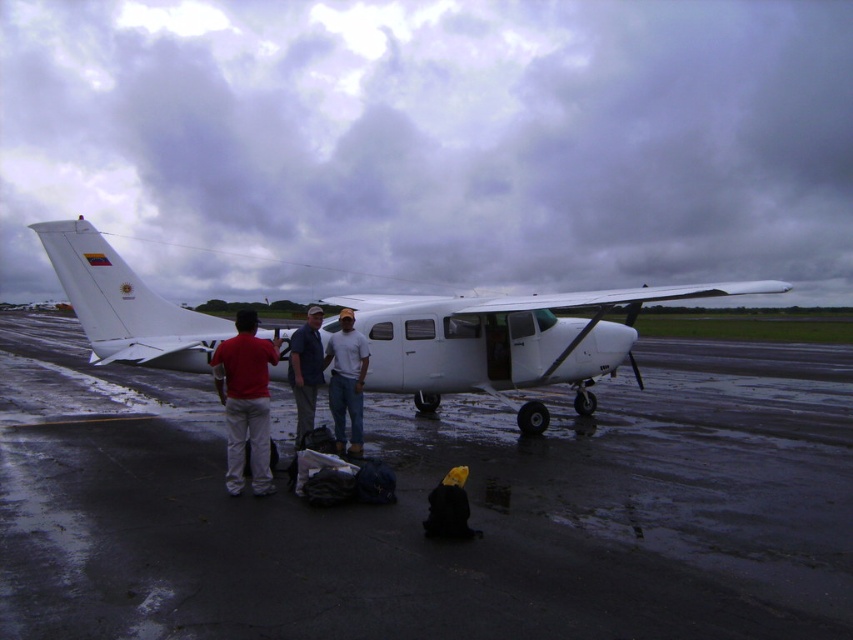
Question: Considering the real-world distances, which object is closest to the white matte shirt at center?

Choices:
 (A) matte red shirt at center
 (B) white cotton shirt at center
 (C) white matte airplane at center

Answer: (B)

Question: Which of the following is the closest to the observer?

Choices:
 (A) (294, 384)
 (B) (352, 394)
 (C) (96, 250)
 (D) (738, 516)

Answer: (D)

Question: In this image, where is white matte airplane at center located relative to matte red shirt at center?

Choices:
 (A) below
 (B) above

Answer: (B)

Question: Considering the relative positions of white matte airplane at center and white matte shirt at center in the image provided, where is white matte airplane at center located with respect to white matte shirt at center?

Choices:
 (A) right
 (B) left

Answer: (A)

Question: Can you confirm if wet asphalt tarmac at center is positioned below white matte shirt at center?

Choices:
 (A) no
 (B) yes

Answer: (B)

Question: Which of these objects is positioned closest to the white cotton shirt at center?

Choices:
 (A) matte red shirt at center
 (B) wet asphalt tarmac at center
 (C) white matte shirt at center
 (D) white matte airplane at center

Answer: (C)